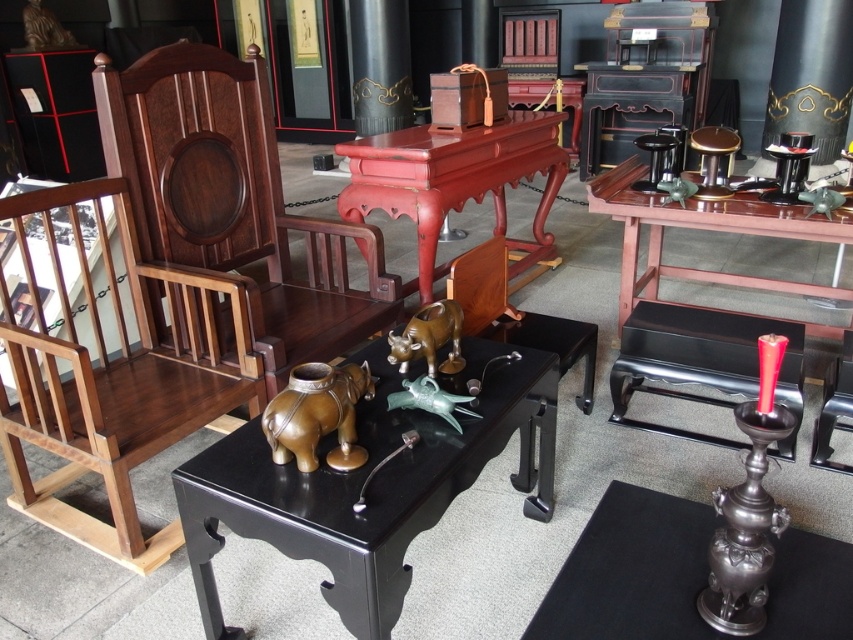
Is black lacquered table at center shorter than shiny bronze bull at center?

No.

What do you see at coordinates (367, 488) in the screenshot? This screenshot has width=853, height=640. I see `black lacquered table at center` at bounding box center [367, 488].

At what (x,y) coordinates should I click in order to perform the action: click on black lacquered table at center. Please return your answer as a coordinate pair (x, y). Looking at the image, I should click on (367, 488).

Which is more to the right, polished silver vase at center or shiny bronze bull at center?

Positioned to the right is polished silver vase at center.

Does polished silver vase at center appear over shiny bronze bull at center?

No.

Image resolution: width=853 pixels, height=640 pixels. In order to click on polished silver vase at center in this screenshot , I will do `click(683, 577)`.

Where is `polished silver vase at center`? This screenshot has height=640, width=853. polished silver vase at center is located at coordinates (683, 577).

Image resolution: width=853 pixels, height=640 pixels. What do you see at coordinates (712, 160) in the screenshot? I see `metallic gold stool at upper right` at bounding box center [712, 160].

At what (x,y) coordinates should I click in order to perform the action: click on metallic gold stool at upper right. Please return your answer as a coordinate pair (x, y). This screenshot has width=853, height=640. Looking at the image, I should click on (712, 160).

Locate an element on the screen. This screenshot has height=640, width=853. metallic gold stool at upper right is located at coordinates (712, 160).